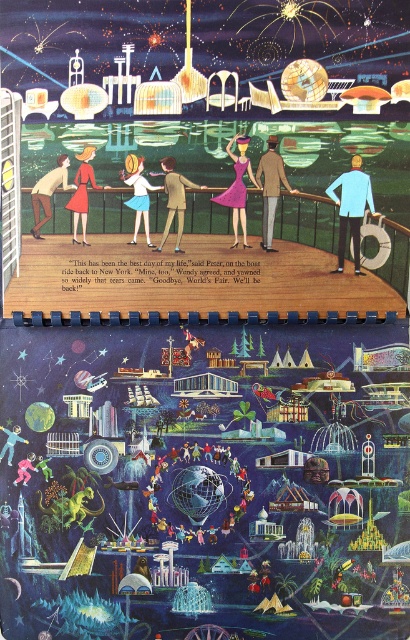
You are a photographer standing on the deck and want to take a photo of both the tan fabric jacket at center and the matte brown suit at center. Which one should you focus on first to ensure both are in focus?

You should focus on the tan fabric jacket at center first because it is closer to the viewer than the matte brown suit at center, so adjusting focus from near to far will help both be in focus.

You are an attendee at the World Fair and you want to find the person wearing the matte purple dress at center. According to the coordinates provided, where exactly is this dress positioned in the image?

The matte purple dress at center is located at point coordinates 0.294 on the x axis and 0.580 on the y axis.